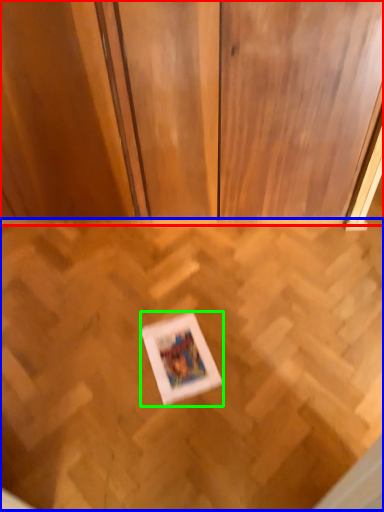
Question: Estimate the real-world distances between objects in this image. Which object is closer to dresser (highlighted by a red box), plywood (highlighted by a blue box) or picture frame (highlighted by a green box)?

Choices:
 (A) plywood
 (B) picture frame

Answer: (A)